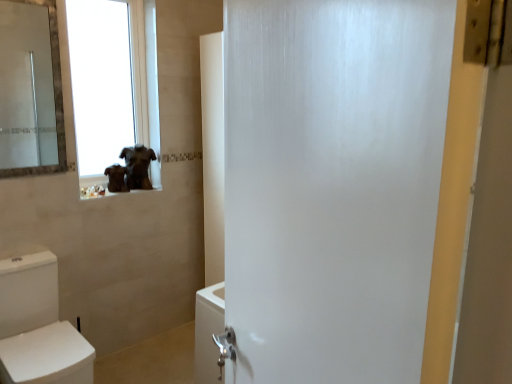
The width and height of the screenshot is (512, 384). I want to click on transparent glass window at upper left, so click(112, 80).

Where is `brown matte statue at upper left, the second animal positioned from the left`? brown matte statue at upper left, the second animal positioned from the left is located at coordinates (137, 166).

From a real-world perspective, which object stands above the other?

brown matte statue at upper left, the second animal positioned from the left, is physically above.

How distant is brown matte statue at upper left, the second animal positioned from the left, from brown fur dog at upper left, which is counted as the second animal, starting from the right?

The distance of brown matte statue at upper left, the second animal positioned from the left, from brown fur dog at upper left, which is counted as the second animal, starting from the right, is 3.37 inches.

Could you tell me if brown matte statue at upper left, marked as the 1th animal in a right-to-left arrangement, is facing brown fur dog at upper left, the first animal viewed from the left?

Yes, brown matte statue at upper left, marked as the 1th animal in a right-to-left arrangement, is aimed at brown fur dog at upper left, the first animal viewed from the left.

How many degrees apart are the facing directions of brown matte statue at upper left, marked as the 1th animal in a right-to-left arrangement, and brown fur dog at upper left, the first animal viewed from the left?

There is a 27.8-degree angle between the facing directions of brown matte statue at upper left, marked as the 1th animal in a right-to-left arrangement, and brown fur dog at upper left, the first animal viewed from the left.

Is white glossy toilet at lower left oriented towards transparent glass window at upper left?

No, white glossy toilet at lower left is not aimed at transparent glass window at upper left.

Is the depth of white glossy toilet at lower left less than that of transparent glass window at upper left?

Yes.

From a real-world perspective, relative to transparent glass window at upper left, is white glossy toilet at lower left vertically above or below?

Clearly, from a real-world perspective, white glossy toilet at lower left is below transparent glass window at upper left.

From a real-world perspective, who is located higher, brown matte statue at upper left, the second animal positioned from the left, or white glossy toilet at lower left?

In real-world perspective, brown matte statue at upper left, the second animal positioned from the left, is above.

Between brown matte statue at upper left, marked as the 1th animal in a right-to-left arrangement, and white glossy toilet at lower left, which one is positioned behind?

brown matte statue at upper left, marked as the 1th animal in a right-to-left arrangement, is further away from the camera.

From the picture: Does brown matte statue at upper left, marked as the 1th animal in a right-to-left arrangement, have a larger size compared to white glossy toilet at lower left?

Actually, brown matte statue at upper left, marked as the 1th animal in a right-to-left arrangement, might be smaller than white glossy toilet at lower left.

How far apart are brown fur dog at upper left, which is counted as the second animal, starting from the right, and transparent glass window at upper left?

A distance of 2.60 meters exists between brown fur dog at upper left, which is counted as the second animal, starting from the right, and transparent glass window at upper left.

From the image's perspective, is brown fur dog at upper left, the first animal viewed from the left, above or below transparent glass window at upper left?

Clearly, from the image's perspective, brown fur dog at upper left, the first animal viewed from the left, is below transparent glass window at upper left.

Choose the correct answer: Is brown fur dog at upper left, the first animal viewed from the left, inside transparent glass window at upper left or outside it?

The correct answer is: outside.

From a real-world perspective, between brown fur dog at upper left, which is counted as the second animal, starting from the right, and transparent glass window at upper left, who is vertically lower?

brown fur dog at upper left, which is counted as the second animal, starting from the right, from a real-world perspective.

Which object is thinner, brown matte statue at upper left, marked as the 1th animal in a right-to-left arrangement, or transparent glass window at upper left?

transparent glass window at upper left is thinner.

Could you tell me if brown matte statue at upper left, marked as the 1th animal in a right-to-left arrangement, is turned towards transparent glass window at upper left?

No.

Who is bigger, brown matte statue at upper left, marked as the 1th animal in a right-to-left arrangement, or transparent glass window at upper left?

Bigger between the two is transparent glass window at upper left.

Is brown matte statue at upper left, the second animal positioned from the left, touching transparent glass window at upper left?

No, brown matte statue at upper left, the second animal positioned from the left, is not in contact with transparent glass window at upper left.

Is brown fur dog at upper left, which is counted as the second animal, starting from the right, spatially inside white glossy toilet at lower left, or outside of it?

brown fur dog at upper left, which is counted as the second animal, starting from the right, is outside white glossy toilet at lower left.

Can you confirm if brown fur dog at upper left, the first animal viewed from the left, is taller than white glossy toilet at lower left?

No, brown fur dog at upper left, the first animal viewed from the left, is not taller than white glossy toilet at lower left.

Does brown fur dog at upper left, the first animal viewed from the left, turn towards white glossy toilet at lower left?

No, brown fur dog at upper left, the first animal viewed from the left, is not aimed at white glossy toilet at lower left.

Who is smaller, brown fur dog at upper left, which is counted as the second animal, starting from the right, or white glossy toilet at lower left?

With smaller size is brown fur dog at upper left, which is counted as the second animal, starting from the right.

Is the surface of transparent glass window at upper left in direct contact with brown matte statue at upper left, the second animal positioned from the left?

No.

From the image's perspective, relative to brown matte statue at upper left, the second animal positioned from the left, is transparent glass window at upper left above or below?

Clearly, from the image's perspective, transparent glass window at upper left is above brown matte statue at upper left, the second animal positioned from the left.

Is transparent glass window at upper left to the left of brown matte statue at upper left, the second animal positioned from the left, from the viewer's perspective?

Indeed, transparent glass window at upper left is positioned on the left side of brown matte statue at upper left, the second animal positioned from the left.

Is transparent glass window at upper left outside of brown matte statue at upper left, marked as the 1th animal in a right-to-left arrangement?

Indeed, transparent glass window at upper left is completely outside brown matte statue at upper left, marked as the 1th animal in a right-to-left arrangement.

At what (x,y) coordinates should I click in order to perform the action: click on animal behind the brown fur dog at upper left, the first animal viewed from the left. Please return your answer as a coordinate pair (x, y). The image size is (512, 384). Looking at the image, I should click on 137,166.

Where is `window positioned vertically above the white glossy toilet at lower left (from a real-world perspective)`? The image size is (512, 384). window positioned vertically above the white glossy toilet at lower left (from a real-world perspective) is located at coordinates (112, 80).

Based on their spatial positions, is transparent glass window at upper left or brown matte statue at upper left, marked as the 1th animal in a right-to-left arrangement, further from white glossy toilet at lower left?

transparent glass window at upper left.

From the image, which object appears to be nearer to white glossy toilet at lower left, brown fur dog at upper left, the first animal viewed from the left, or transparent glass window at upper left?

brown fur dog at upper left, the first animal viewed from the left.

Estimate the real-world distances between objects in this image. Which object is closer to white glossy toilet at lower left, brown matte statue at upper left, the second animal positioned from the left, or transparent glass window at upper left?

brown matte statue at upper left, the second animal positioned from the left, lies closer to white glossy toilet at lower left than the other object.

Based on their spatial positions, is brown matte statue at upper left, the second animal positioned from the left, or brown fur dog at upper left, which is counted as the second animal, starting from the right, further from transparent glass window at upper left?

brown fur dog at upper left, which is counted as the second animal, starting from the right.

Considering their positions, is transparent glass window at upper left positioned further to brown matte statue at upper left, marked as the 1th animal in a right-to-left arrangement, than brown fur dog at upper left, which is counted as the second animal, starting from the right?

Based on the image, transparent glass window at upper left appears to be further to brown matte statue at upper left, marked as the 1th animal in a right-to-left arrangement.

Considering their positions, is brown fur dog at upper left, which is counted as the second animal, starting from the right, positioned further to transparent glass window at upper left than brown matte statue at upper left, the second animal positioned from the left?

brown fur dog at upper left, which is counted as the second animal, starting from the right, lies further to transparent glass window at upper left than the other object.

Which object lies nearer to the anchor point brown fur dog at upper left, the first animal viewed from the left, transparent glass window at upper left or brown matte statue at upper left, marked as the 1th animal in a right-to-left arrangement?

brown matte statue at upper left, marked as the 1th animal in a right-to-left arrangement.

Which object lies nearer to the anchor point brown fur dog at upper left, which is counted as the second animal, starting from the right, brown matte statue at upper left, marked as the 1th animal in a right-to-left arrangement, or white glossy toilet at lower left?

Among the two, brown matte statue at upper left, marked as the 1th animal in a right-to-left arrangement, is located nearer to brown fur dog at upper left, which is counted as the second animal, starting from the right.

Where is `animal between transparent glass window at upper left and brown fur dog at upper left, which is counted as the second animal, starting from the right, vertically`? animal between transparent glass window at upper left and brown fur dog at upper left, which is counted as the second animal, starting from the right, vertically is located at coordinates (137, 166).

Identify the location of animal located between white glossy toilet at lower left and brown matte statue at upper left, marked as the 1th animal in a right-to-left arrangement, in the depth direction. (116, 178).